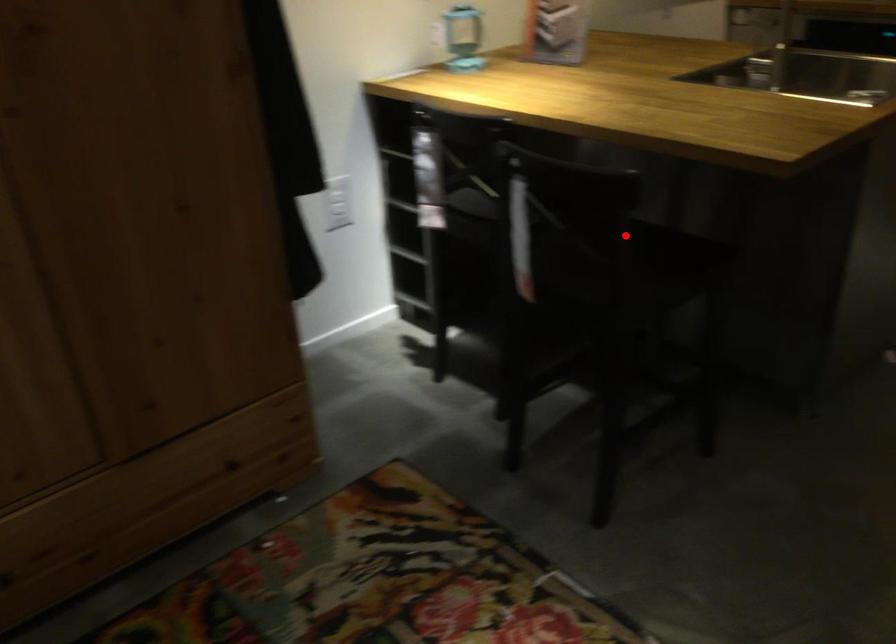
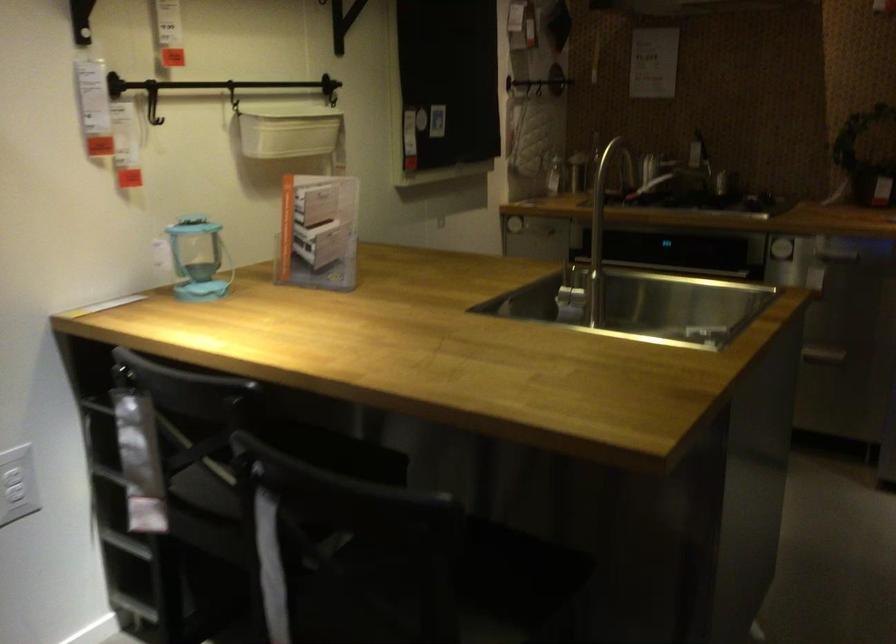
Where in the second image is the point corresponding to the highlighted location from the first image?

(444, 590)